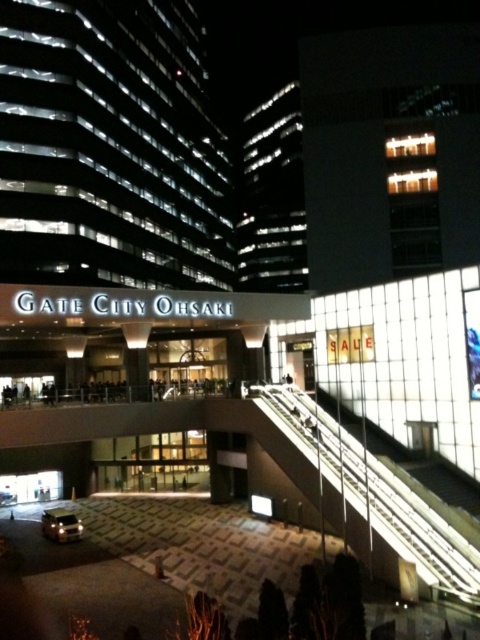
You are standing at the entrance of GATE CITY OHSAKI and want to take a photo of both the SALE sign and the staircase. The SALE sign is located at point (40,518) and the staircase is near point (302,408). Since you want the staircase to appear larger in your photo, which point should you focus on first?

Point (302,408) is closer to the camera than point (40,518). To make the staircase appear larger in the photo, you should focus on point (302,408) first because it is nearer to the camera, allowing the staircase to take up more of the frame.

You are a delivery person trying to unload a large package that is 2 meters wide. You see the transparent glass escalator at center and the shiny silver suv at lower left. Which object can accommodate the width of your package?

The transparent glass escalator at center is bigger than the shiny silver suv at lower left, so the transparent glass escalator at center can accommodate the width of the 2 meter package.

You are a delivery person needing to reach the entrance of GATE CITY OHSAKI. You see the transparent glass escalator at center and the shiny silver suv at lower left. Which object is closer to the entrance?

The transparent glass escalator at center is closer to the entrance because it is positioned to the right of the shiny silver suv at lower left, which is further away from the entrance.